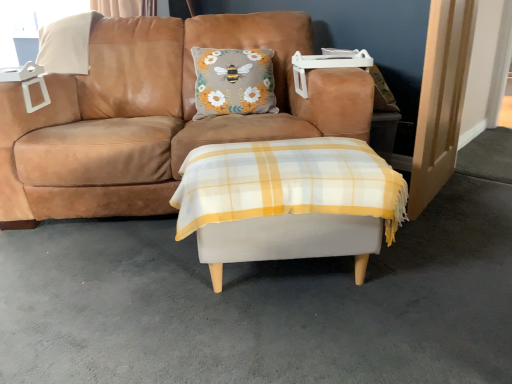
Question: Is light wood door at right far away from white plastic window screen at upper left?

Choices:
 (A) no
 (B) yes

Answer: (B)

Question: Is light wood door at right positioned behind white plastic window screen at upper left?

Choices:
 (A) yes
 (B) no

Answer: (B)

Question: Is light wood door at right facing towards white plastic window screen at upper left?

Choices:
 (A) no
 (B) yes

Answer: (A)

Question: From the image's perspective, is light wood door at right on white plastic window screen at upper left?

Choices:
 (A) yes
 (B) no

Answer: (B)

Question: Can you confirm if light wood door at right is taller than white plastic window screen at upper left?

Choices:
 (A) yes
 (B) no

Answer: (A)

Question: From a real-world perspective, is light wood door at right beneath white plastic window screen at upper left?

Choices:
 (A) no
 (B) yes

Answer: (B)

Question: Does light wood door at right contain white fabric ottoman at center?

Choices:
 (A) no
 (B) yes

Answer: (A)

Question: Would you consider light wood door at right to be distant from white fabric ottoman at center?

Choices:
 (A) no
 (B) yes

Answer: (A)

Question: Is light wood door at right bigger than white fabric ottoman at center?

Choices:
 (A) yes
 (B) no

Answer: (B)

Question: Does light wood door at right have a lesser height compared to white fabric ottoman at center?

Choices:
 (A) no
 (B) yes

Answer: (A)

Question: Is light wood door at right facing towards white fabric ottoman at center?

Choices:
 (A) yes
 (B) no

Answer: (B)

Question: Considering the relative positions of light wood door at right and white fabric ottoman at center in the image provided, is light wood door at right to the left of white fabric ottoman at center from the viewer's perspective?

Choices:
 (A) no
 (B) yes

Answer: (A)

Question: Does white plastic window screen at upper left touch white fabric ottoman at center?

Choices:
 (A) no
 (B) yes

Answer: (A)